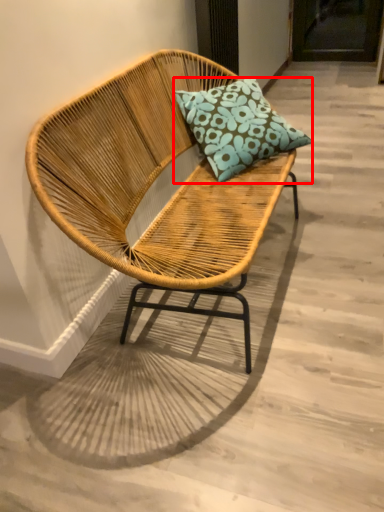
Question: From the image's perspective, considering the relative positions of pillow (annotated by the red box) and chair in the image provided, where is pillow (annotated by the red box) located with respect to the staircase?

Choices:
 (A) below
 (B) above

Answer: (B)